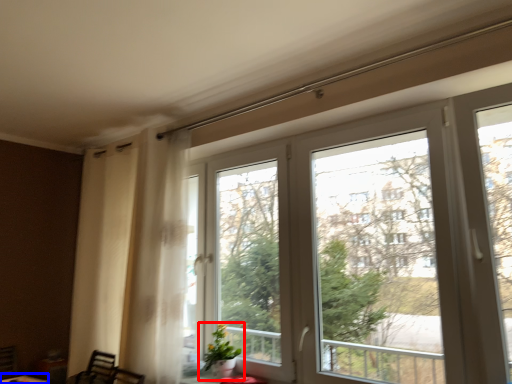
Question: Which point is further to the camera, houseplant (highlighted by a red box) or round table (highlighted by a blue box)?

Choices:
 (A) houseplant
 (B) round table

Answer: (B)